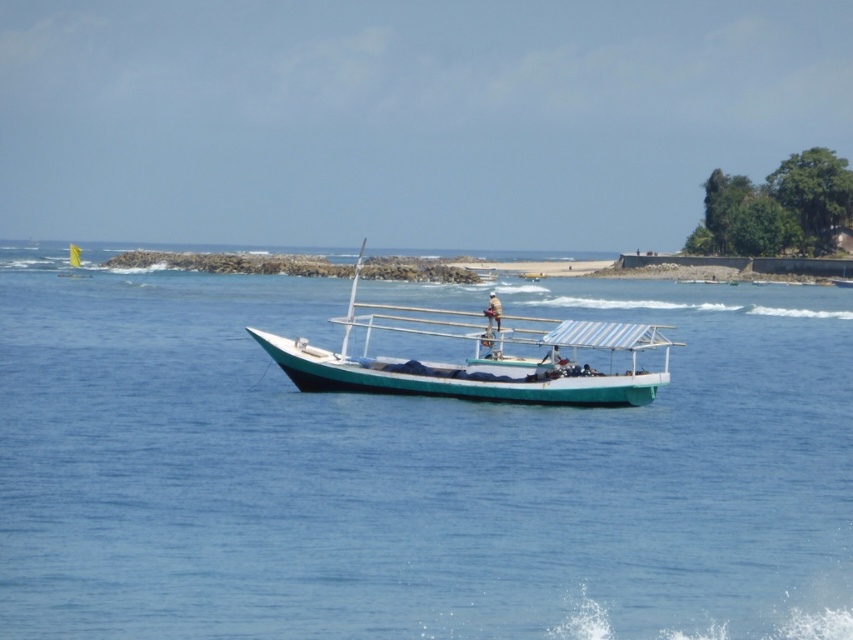
Is blue water at center wider than teal matte boat at center?

Yes, blue water at center is wider than teal matte boat at center.

Is blue water at center shorter than teal matte boat at center?

Incorrect, blue water at center's height does not fall short of teal matte boat at center's.

Which is in front, point (32, 378) or point (650, 380)?

Point (650, 380) is in front.

Image resolution: width=853 pixels, height=640 pixels. What are the coordinates of `blue water at center` in the screenshot? It's located at (412, 472).